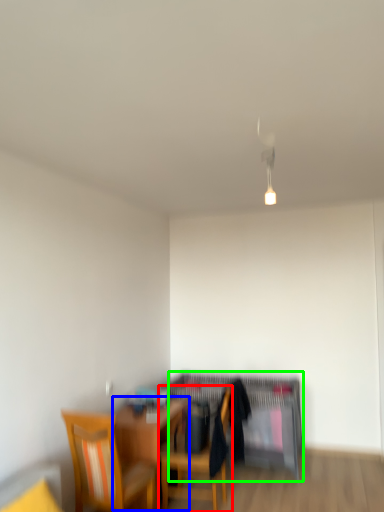
Question: Estimate the real-world distances between objects in this image. Which object is closer to chair (highlighted by a red box), table (highlighted by a blue box) or computer desk (highlighted by a green box)?

Choices:
 (A) table
 (B) computer desk

Answer: (A)